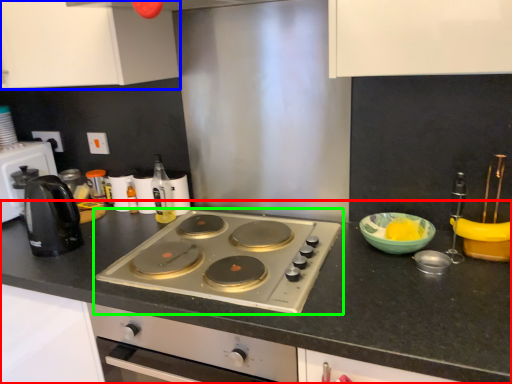
Question: Estimate the real-world distances between objects in this image. Which object is closer to countertop (highlighted by a red box), cabinetry (highlighted by a blue box) or gas stove (highlighted by a green box)?

Choices:
 (A) cabinetry
 (B) gas stove

Answer: (B)